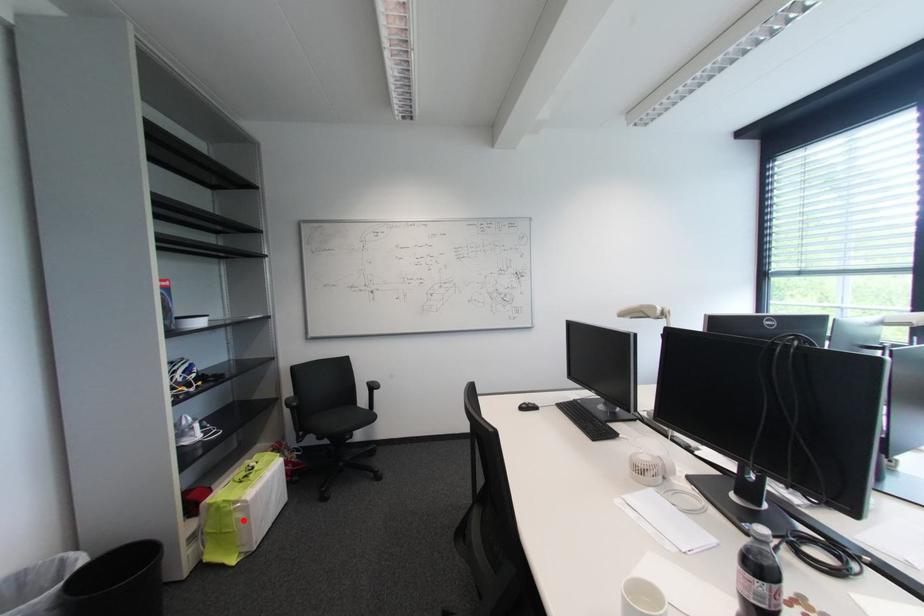
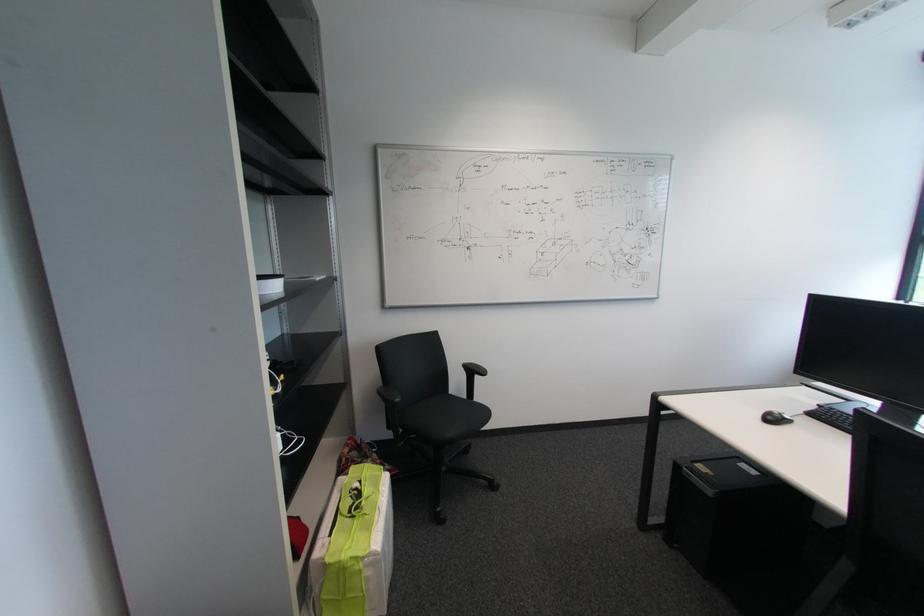
Question: A red point is marked in image1. In image2, is the corresponding 3D point closer to the camera or farther? Reply with the corresponding letter.

Choices:
 (A) The corresponding 3D point is closer.
 (B) The corresponding 3D point is farther.

Answer: (B)